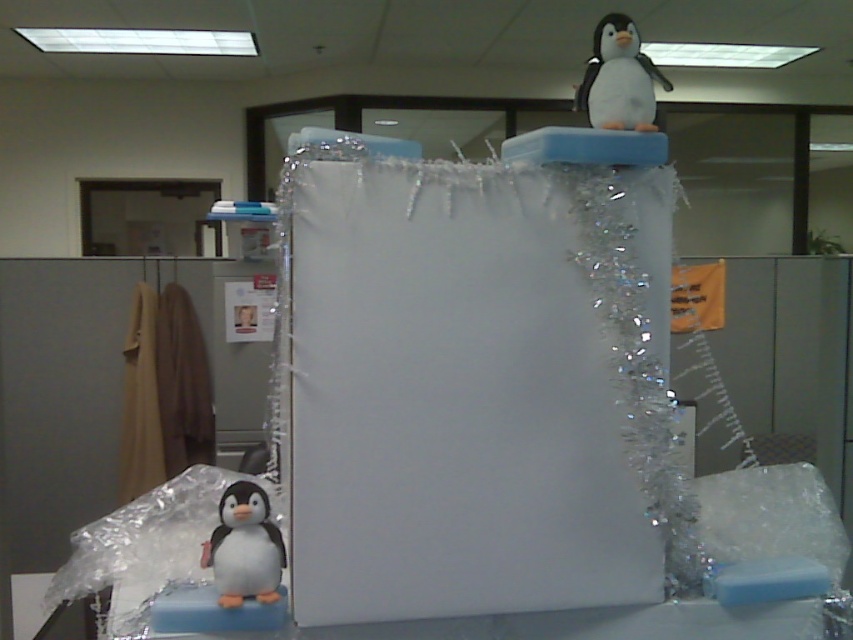
Question: Can you confirm if white matte penguin at lower left is positioned below white plush penguin at upper center?

Choices:
 (A) no
 (B) yes

Answer: (B)

Question: Which point is closer to the camera?

Choices:
 (A) white matte penguin at lower left
 (B) white plush penguin at upper center

Answer: (A)

Question: Is white matte penguin at lower left behind white plush penguin at upper center?

Choices:
 (A) no
 (B) yes

Answer: (A)

Question: Can you confirm if white matte penguin at lower left is bigger than white plush penguin at upper center?

Choices:
 (A) yes
 (B) no

Answer: (B)

Question: Which point is farther to the camera?

Choices:
 (A) white plush penguin at upper center
 (B) white matte penguin at lower left

Answer: (A)